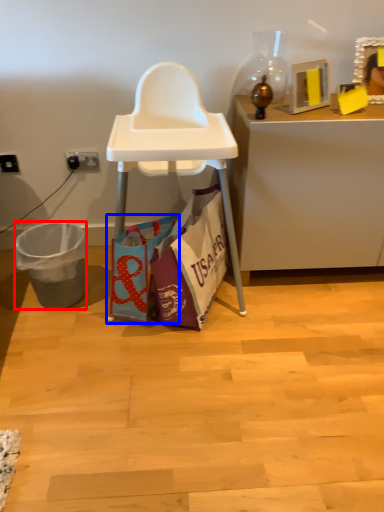
Question: Among these objects, which one is farthest to the camera, trash bin/can (highlighted by a red box) or handbag (highlighted by a blue box)?

Choices:
 (A) trash bin/can
 (B) handbag

Answer: (A)